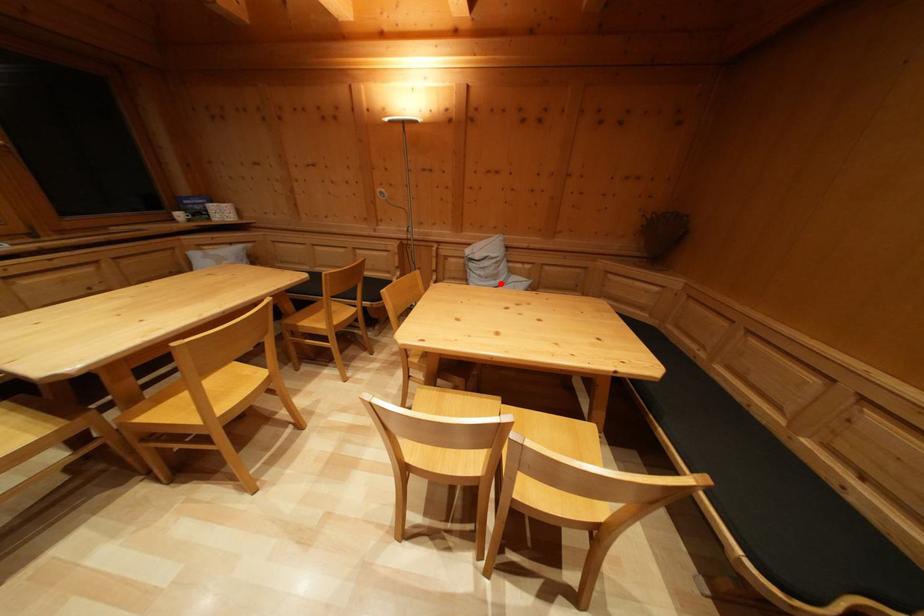
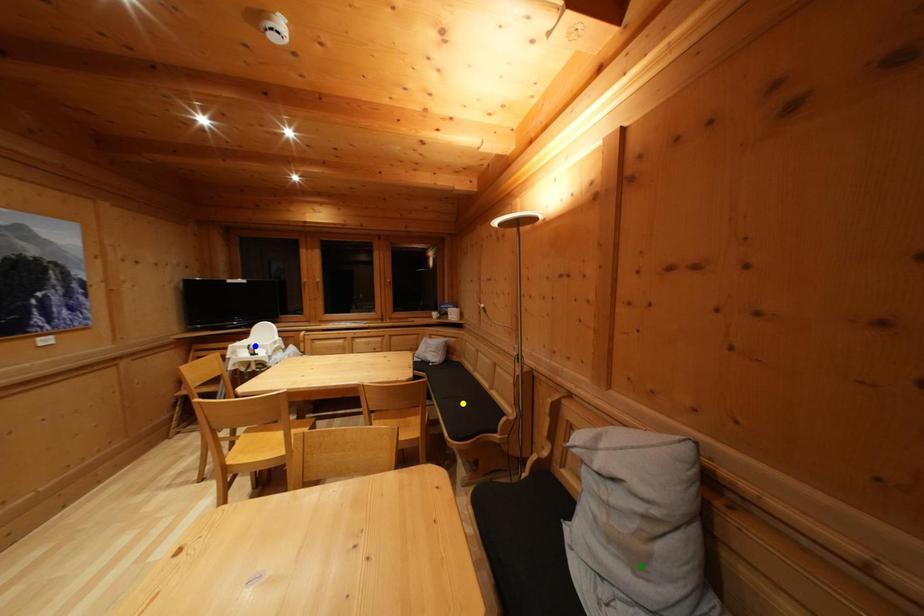
Question: I am providing you with two images of the same scene from different viewpoints. A red point is marked on the first image. You are given multiple points on the second image. Which point in image 2 is actually the same real-world point as the red point in image 1?

Choices:
 (A) blue point
 (B) yellow point
 (C) green point

Answer: (C)